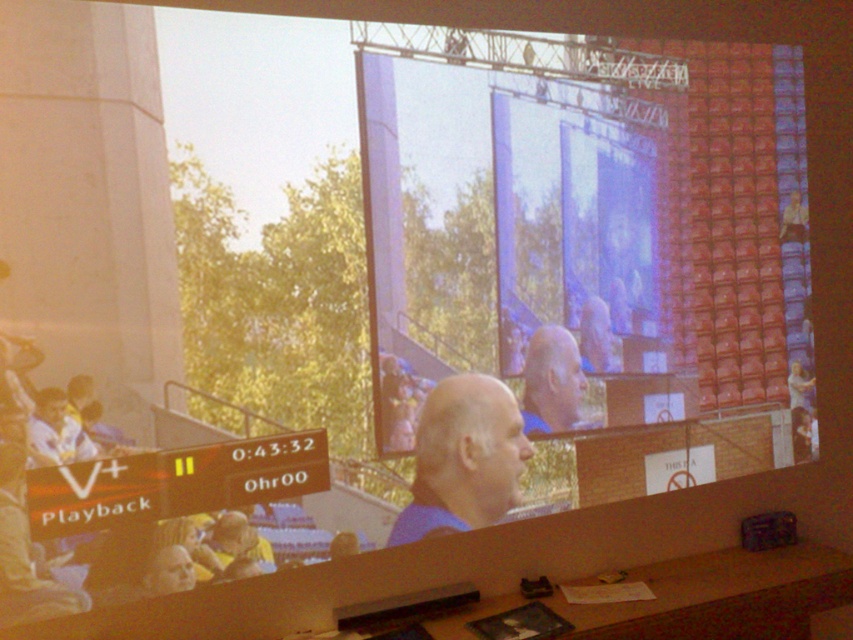
Question: Can you confirm if blue fabric shirt at center is bigger than smooth blue shirt at center?

Choices:
 (A) no
 (B) yes

Answer: (B)

Question: Does blue fabric shirt at center have a lesser width compared to smooth blue shirt at center?

Choices:
 (A) no
 (B) yes

Answer: (A)

Question: Which point is farther to the camera?

Choices:
 (A) blue fabric shirt at center
 (B) smooth blue shirt at center

Answer: (B)

Question: Is blue fabric shirt at center to the right of smooth blue shirt at center from the viewer's perspective?

Choices:
 (A) no
 (B) yes

Answer: (A)

Question: Which of the following is the farthest from the observer?

Choices:
 (A) (541, 364)
 (B) (473, 452)

Answer: (A)

Question: Which object appears farthest from the camera in this image?

Choices:
 (A) blue fabric shirt at center
 (B) smooth blue shirt at center

Answer: (B)